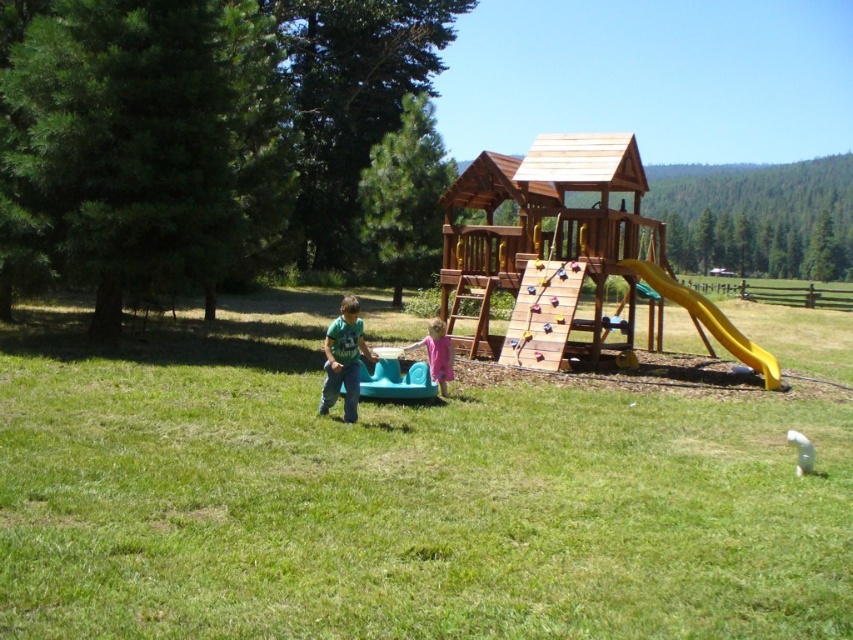
Question: Which object is closer to the camera taking this photo?

Choices:
 (A) green matte shirt at center
 (B) pink fabric dress at center
 (C) green plastic wagon at center

Answer: (C)

Question: Which point appears closest to the camera in this image?

Choices:
 (A) (793, 442)
 (B) (434, 376)
 (C) (329, 388)

Answer: (A)

Question: Is green matte shirt at center wider than pink fabric dress at center?

Choices:
 (A) yes
 (B) no

Answer: (A)

Question: Which object is positioned farthest from the green plastic wagon at center?

Choices:
 (A) pink fabric dress at center
 (B) white plastic ball at lower right
 (C) yellow matte slide at right
 (D) green matte shirt at center

Answer: (B)

Question: Is yellow matte slide at right below pink fabric dress at center?

Choices:
 (A) no
 (B) yes

Answer: (A)

Question: Can you confirm if yellow matte slide at right is smaller than white plastic ball at lower right?

Choices:
 (A) yes
 (B) no

Answer: (B)